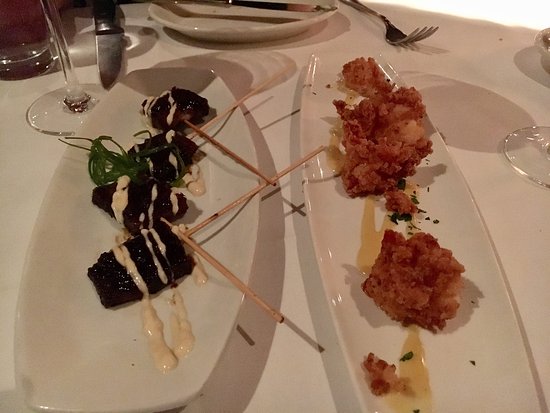
This screenshot has height=413, width=550. I want to click on white boat plates, so click(x=233, y=226), click(x=332, y=222).